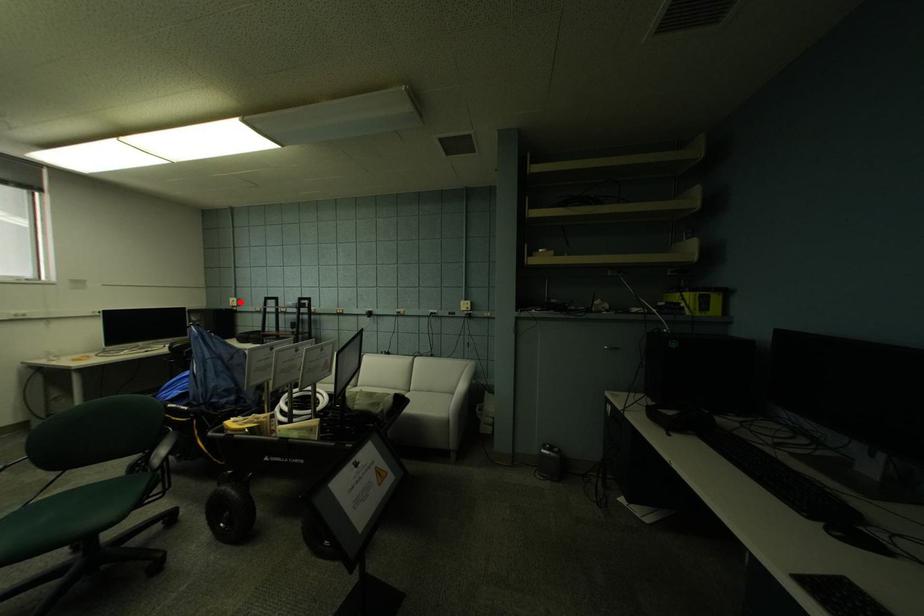
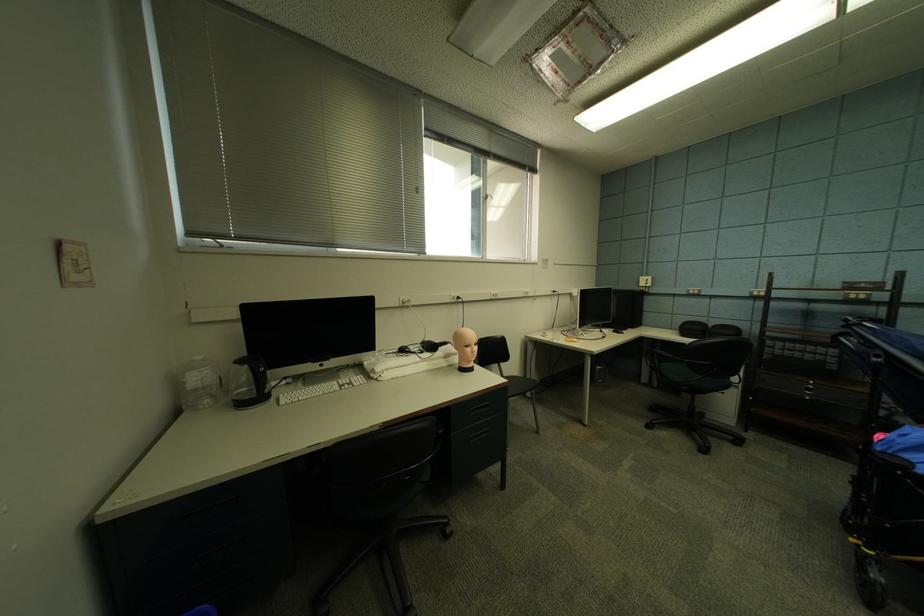
The point at the highlighted location is marked in the first image. Where is the corresponding point in the second image?

(650, 282)